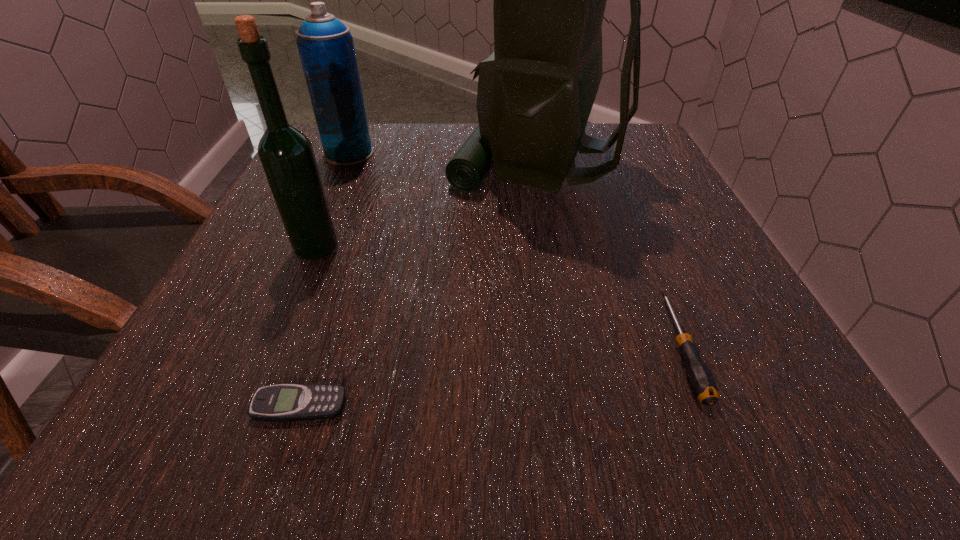
What are the coordinates of `vacant space at the far left corner of the desktop` in the screenshot? It's located at (319, 166).

I want to click on vacant space at the far right corner of the desktop, so click(x=634, y=165).

Where is `vacant region at the near right corner of the desktop`? The width and height of the screenshot is (960, 540). vacant region at the near right corner of the desktop is located at coordinates (766, 410).

Where is `vacant space in between the fourth shortest object and the tallest object`? The image size is (960, 540). vacant space in between the fourth shortest object and the tallest object is located at coordinates (427, 205).

Where is `empty space that is in between the third shortest object and the tallest object`? empty space that is in between the third shortest object and the tallest object is located at coordinates (444, 158).

The width and height of the screenshot is (960, 540). What are the coordinates of `free space between the third tallest object and the screwdriver` in the screenshot? It's located at (515, 251).

Where is `free space between the fourth tallest object and the liquor`? free space between the fourth tallest object and the liquor is located at coordinates (498, 298).

At what (x,y) coordinates should I click in order to perform the action: click on free space between the backpack and the shortest object. Please return your answer as a coordinate pair (x, y). Image resolution: width=960 pixels, height=540 pixels. Looking at the image, I should click on (419, 284).

This screenshot has height=540, width=960. Identify the location of vacant area that lies between the fourth tallest object and the shortest object. (491, 376).

Locate an element on the screen. This screenshot has width=960, height=540. free point between the tallest object and the fourth shortest object is located at coordinates (427, 205).